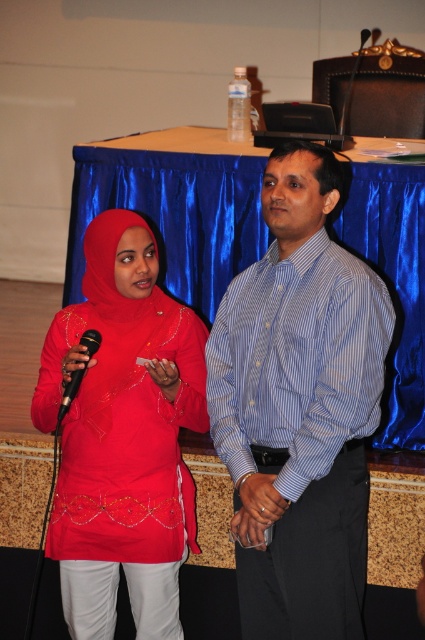
Who is shorter, blue striped shirt at center or black plastic microphone at left?

black plastic microphone at left

Is point (280, 408) less distant than point (65, 410)?

Yes, point (280, 408) is closer to viewer.

Who is more forward, (x=300, y=164) or (x=95, y=333)?

Point (x=300, y=164) is in front.

Image resolution: width=425 pixels, height=640 pixels. I want to click on blue striped shirt at center, so click(x=299, y=406).

Who is more distant from viewer, (113, 336) or (67, 388)?

The point (113, 336) is more distant.

Which is more to the left, matte red dress at center or black plastic microphone at left?

Positioned to the left is black plastic microphone at left.

Who is more distant from viewer, (70, 576) or (82, 378)?

Point (70, 576)

Identify the location of matte red dress at center. pos(122,435).

Is point (288, 397) behind point (68, 374)?

No, it is not.

Is blue striped shirt at center shorter than matte red dress at center?

Incorrect, blue striped shirt at center's height does not fall short of matte red dress at center's.

This screenshot has height=640, width=425. Identify the location of blue striped shirt at center. (299, 406).